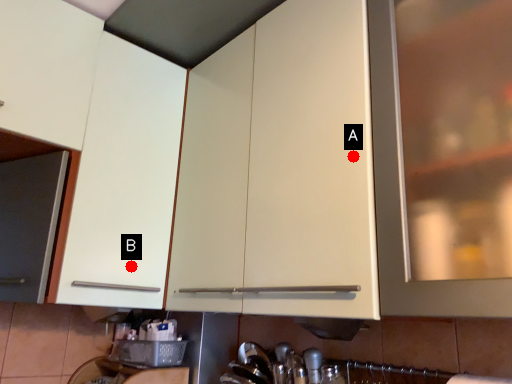
Question: Two points are circled on the image, labeled by A and B beside each circle. Which point is closer to the camera?

Choices:
 (A) A is closer
 (B) B is closer

Answer: (A)